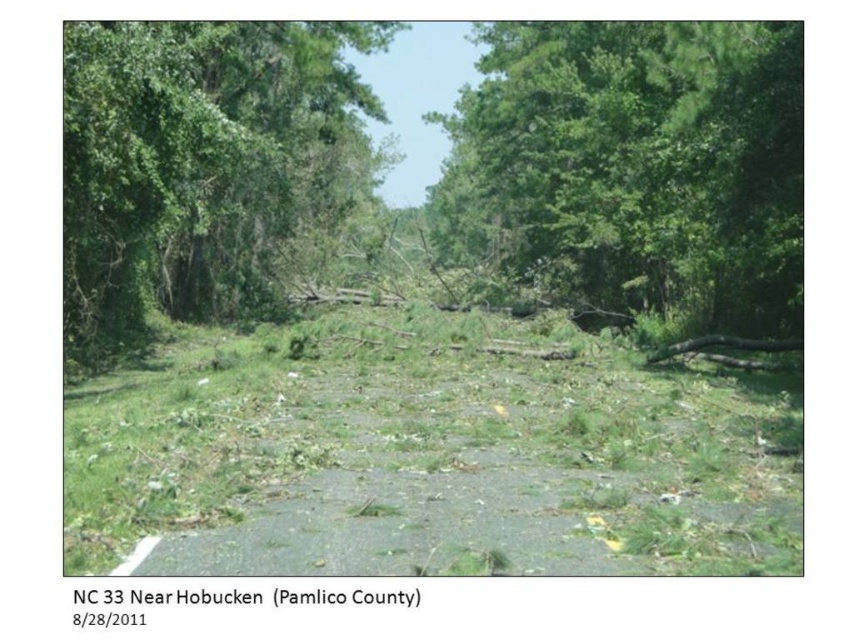
Looking at this image, does green leafy trees at center appear on the left side of green leafy tree at left?

In fact, green leafy trees at center is to the right of green leafy tree at left.

Where is `green leafy trees at center`? This screenshot has height=640, width=853. green leafy trees at center is located at coordinates (631, 177).

At what (x,y) coordinates should I click in order to perform the action: click on green leafy trees at center. Please return your answer as a coordinate pair (x, y). This screenshot has width=853, height=640. Looking at the image, I should click on (631, 177).

Who is higher up, green leafy tree at center or green leafy tree at left?

green leafy tree at center is above.

Describe the element at coordinates (637, 164) in the screenshot. I see `green leafy tree at center` at that location.

Locate an element on the screen. green leafy tree at center is located at coordinates (637, 164).

The height and width of the screenshot is (640, 853). What are the coordinates of `green leafy trees at center` in the screenshot? It's located at (631, 177).

Consider the image. Does green leafy trees at center have a lesser width compared to green leafy tree at center?

No, green leafy trees at center is not thinner than green leafy tree at center.

You are a GUI agent. You are given a task and a screenshot of the screen. Output one action in this format:
    pyautogui.click(x=<x>, y=<y>)
    Task: Click on the green leafy trees at center
    
    Given the screenshot: What is the action you would take?
    pyautogui.click(x=631, y=177)